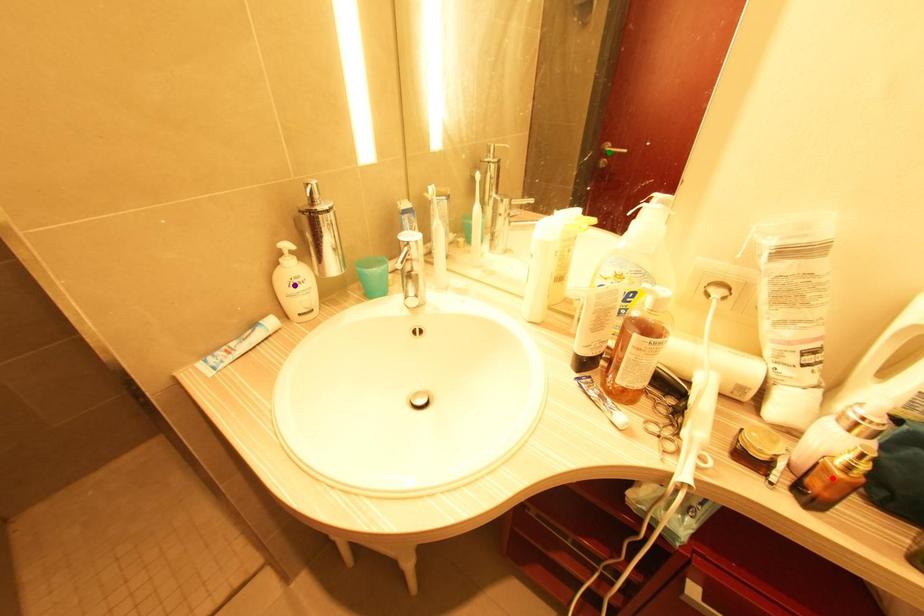
Order these from nearest to farthest:
red point | green point | purple point

red point
purple point
green point